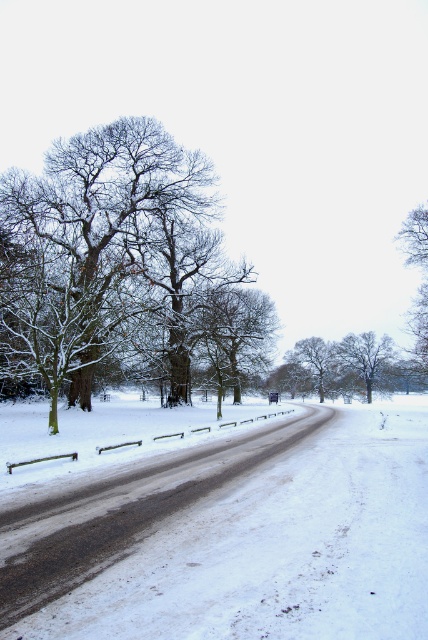
Question: Can you confirm if snow-covered bark tree at upper left is thinner than snowy bark tree at center?

Choices:
 (A) no
 (B) yes

Answer: (A)

Question: Which point is closer to the camera?

Choices:
 (A) white powdery snow at center
 (B) snowy bark tree at right

Answer: (A)

Question: Can you confirm if white powdery snow at center is wider than snowy bark tree at right?

Choices:
 (A) yes
 (B) no

Answer: (A)

Question: Is snow-covered bark tree at upper left further to camera compared to snowy bark tree at right?

Choices:
 (A) no
 (B) yes

Answer: (A)

Question: Which object is positioned closest to the snow-covered tree at center?

Choices:
 (A) snowy bare tree at center
 (B) white powdery snow at center

Answer: (A)

Question: Among these objects, which one is nearest to the camera?

Choices:
 (A) snowy bark tree at center
 (B) white powdery snow at center

Answer: (B)